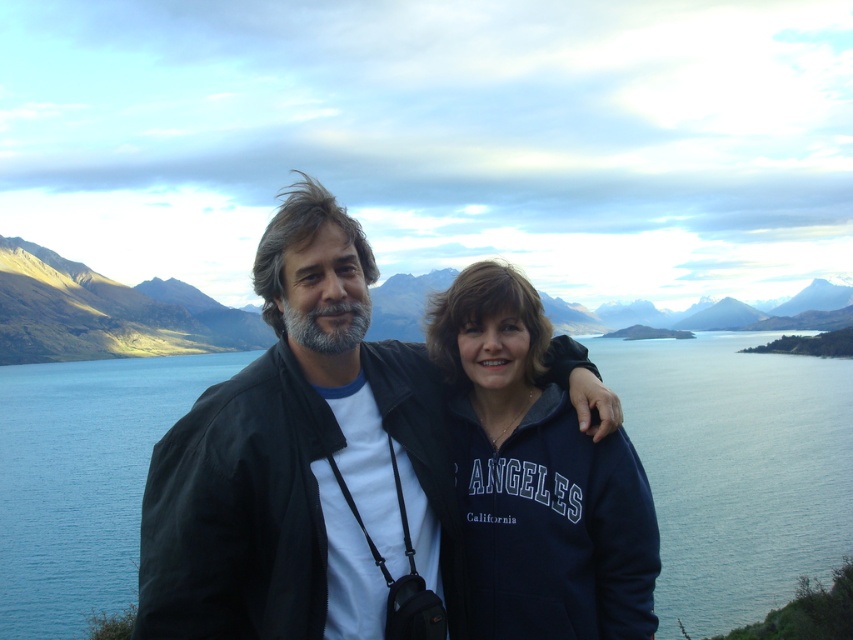
Question: Is the position of dark blue jacket at center less distant than that of blue water at center?

Choices:
 (A) yes
 (B) no

Answer: (A)

Question: Which point appears farthest from the camera in this image?

Choices:
 (A) (198, 472)
 (B) (469, 403)

Answer: (B)

Question: Which object is farther from the camera taking this photo?

Choices:
 (A) blue water at center
 (B) dark blue jacket at center
 (C) navy blue fleece at center

Answer: (A)

Question: Among these objects, which one is farthest from the camera?

Choices:
 (A) blue water at center
 (B) navy blue fleece at center

Answer: (A)

Question: Does dark blue jacket at center come behind navy blue fleece at center?

Choices:
 (A) no
 (B) yes

Answer: (A)

Question: Does blue water at center have a larger size compared to navy blue fleece at center?

Choices:
 (A) no
 (B) yes

Answer: (B)